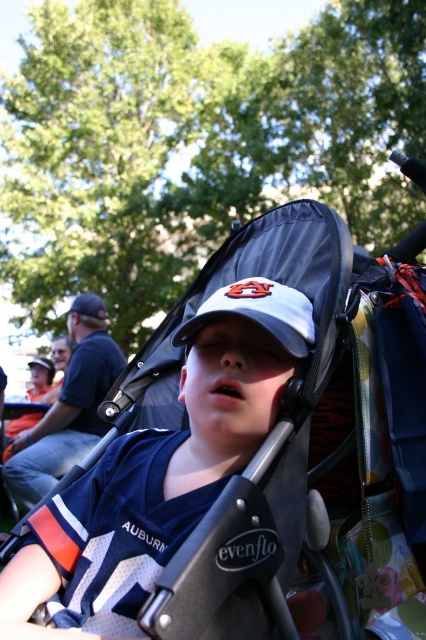
Which of these two, white matte baseball cap at center or gray matte baseball cap at center, stands taller?

white matte baseball cap at center

How far apart are white matte baseball cap at center and gray matte baseball cap at center?

The distance of white matte baseball cap at center from gray matte baseball cap at center is 5.71 inches.

The image size is (426, 640). What do you see at coordinates (158, 472) in the screenshot? I see `white matte baseball cap at center` at bounding box center [158, 472].

This screenshot has height=640, width=426. Find the location of `white matte baseball cap at center`. white matte baseball cap at center is located at coordinates (158, 472).